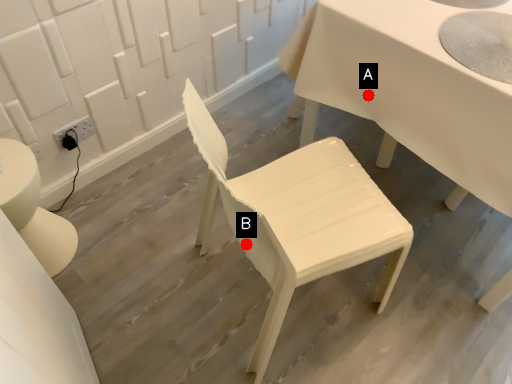
Question: Two points are circled on the image, labeled by A and B beside each circle. Which point is closer to the camera?

Choices:
 (A) A is closer
 (B) B is closer

Answer: (B)